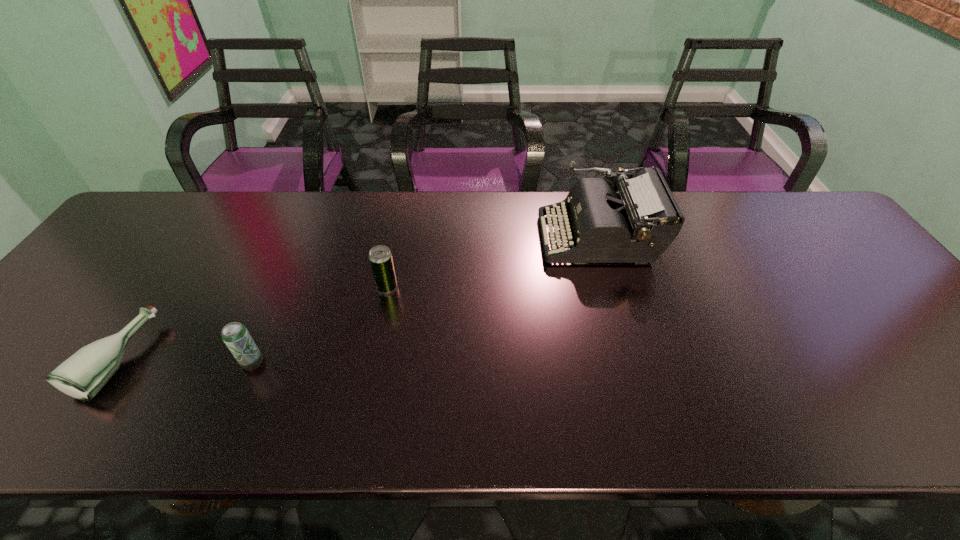
The image size is (960, 540). Identify the location of object that ranks as the second closest to the left beer can. (380, 257).

Find the location of a particular element. This screenshot has width=960, height=540. object that is the closest to the farthest object is located at coordinates (380, 257).

You are a GUI agent. You are given a task and a screenshot of the screen. Output one action in this format:
    pyautogui.click(x=<x>, y=<y>)
    Task: Click on the free space that satisfies the following two spatial constraints: 1. on the back side of the leftmost object; 2. on the right side of the second object from right to left
    The width and height of the screenshot is (960, 540).
    Given the screenshot: What is the action you would take?
    pyautogui.click(x=166, y=287)